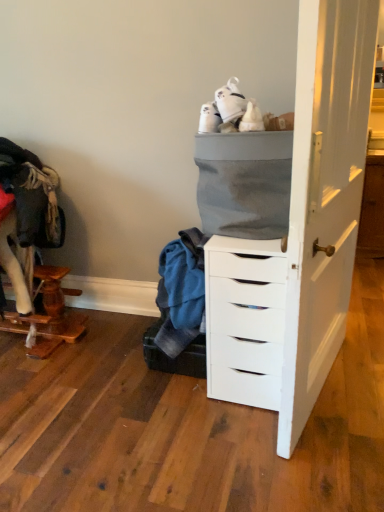
This screenshot has width=384, height=512. What are the coordinates of `vacant area in front of wooden cat tree at left` in the screenshot? It's located at (46, 397).